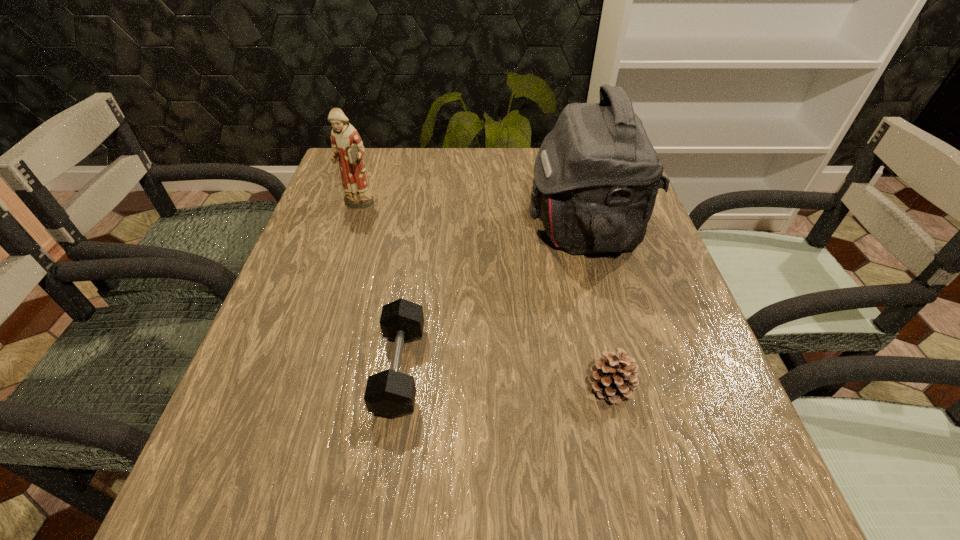
At what (x,y) coordinates should I click in order to perform the action: click on vacant space in between the tallest object and the dumbbell. Please return your answer as a coordinate pair (x, y). Looking at the image, I should click on (492, 299).

The height and width of the screenshot is (540, 960). I want to click on vacant point located between the leftmost object and the second object from left to right, so click(x=379, y=287).

You are a GUI agent. You are given a task and a screenshot of the screen. Output one action in this format:
    pyautogui.click(x=<x>, y=<y>)
    Task: Click on the second closest object to the pinecone
    
    Given the screenshot: What is the action you would take?
    pyautogui.click(x=390, y=393)

Choose which object is the nearest neighbor to the tallest object. Please provide its 2D coordinates. Your answer should be formatted as a tuple, i.e. [(x, y)], where the tuple contains the x and y coordinates of a point satisfying the conditions above.

[(613, 378)]

At what (x,y) coordinates should I click in order to perform the action: click on free location that satisfies the following two spatial constraints: 1. on the front-facing side of the dumbbell; 2. on the right side of the third shortest object. Please return your answer as a coordinate pair (x, y). Looking at the image, I should click on (303, 369).

Identify the location of vacant space that satisfies the following two spatial constraints: 1. on the front-facing side of the leftmost object; 2. on the left side of the pinecone. Image resolution: width=960 pixels, height=540 pixels. (298, 388).

Identify the location of free point that satisfies the following two spatial constraints: 1. on the front-facing side of the figurine; 2. on the left side of the dumbbell. Image resolution: width=960 pixels, height=540 pixels. (303, 369).

Where is `blank space that satisfies the following two spatial constraints: 1. on the open flap of the tallest object; 2. on the front side of the pinecone`? This screenshot has height=540, width=960. blank space that satisfies the following two spatial constraints: 1. on the open flap of the tallest object; 2. on the front side of the pinecone is located at coordinates (624, 388).

You are a GUI agent. You are given a task and a screenshot of the screen. Output one action in this format:
    pyautogui.click(x=<x>, y=<y>)
    Task: Click on the free space in the image that satisfies the following two spatial constraints: 1. on the front-facing side of the pinecone; 2. on the right side of the figurine
    The height and width of the screenshot is (540, 960).
    Given the screenshot: What is the action you would take?
    pyautogui.click(x=298, y=388)

This screenshot has height=540, width=960. What are the coordinates of `free region that satisfies the following two spatial constraints: 1. on the front-facing side of the second object from left to right; 2. on the right side of the figurine` in the screenshot? It's located at (303, 369).